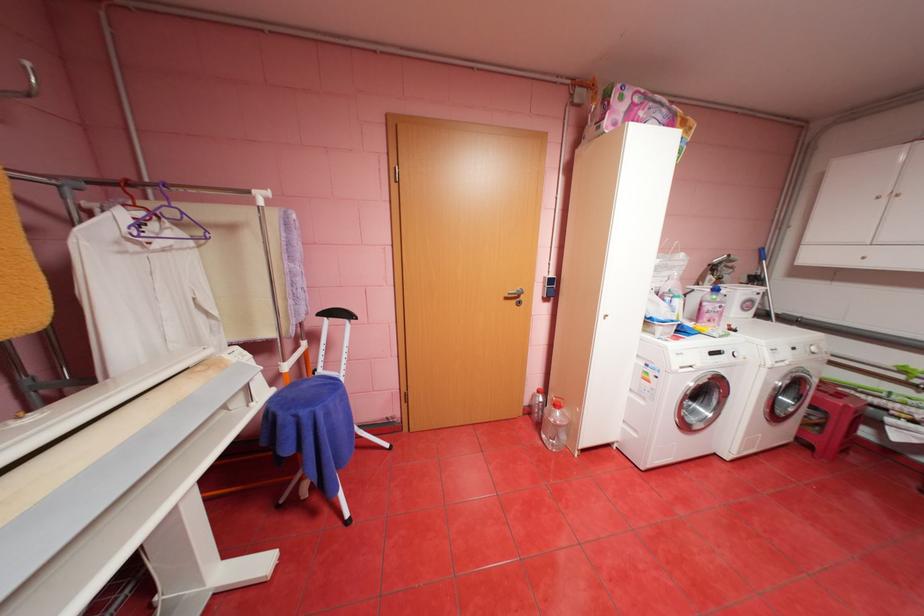
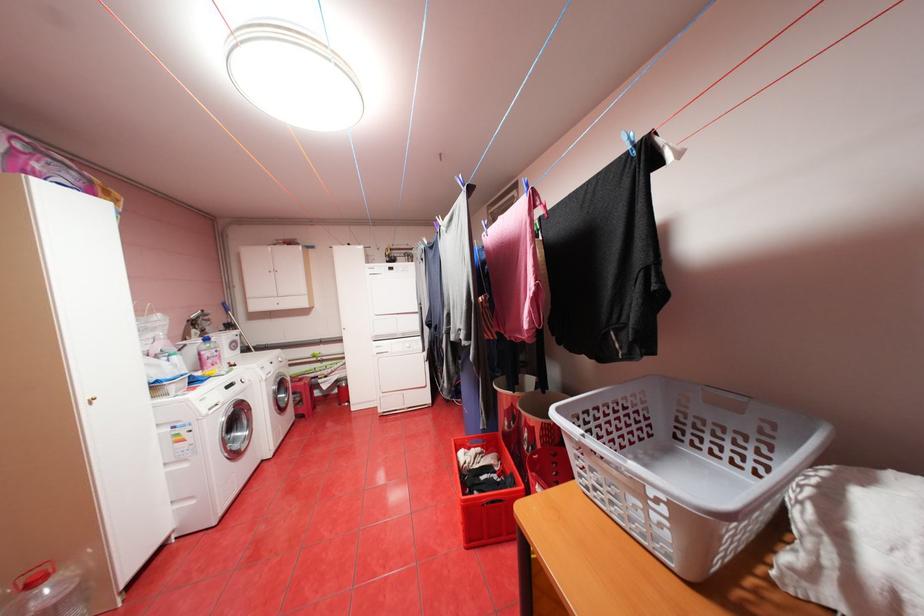
Find the pixel in the second image that matches point 848,395 in the first image.

(310, 379)